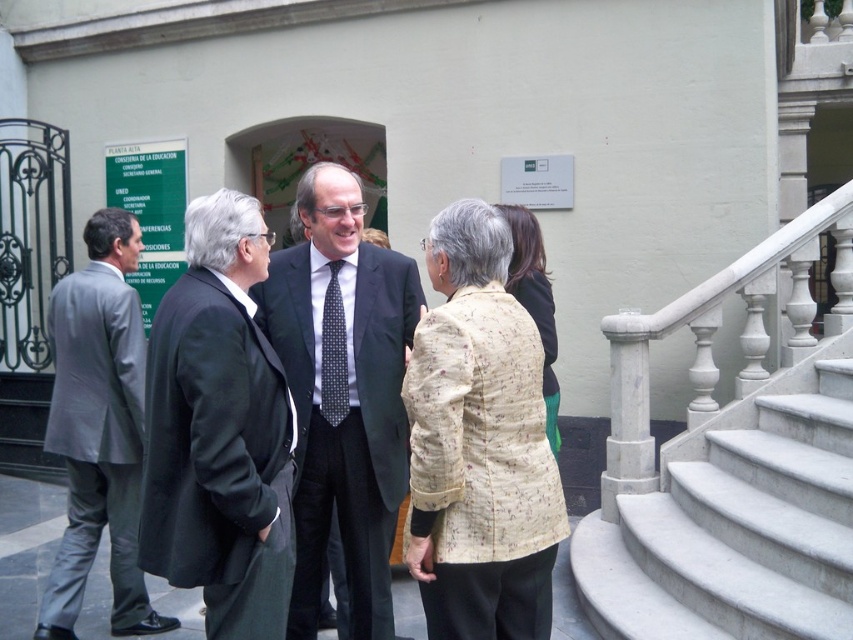
Based on the photo, you are organizing a formal event and need to ensure that all attire items are displayed properly. If you have a display stand that can accommodate items up to the width of the black dotted tie at center, will the black wool coat at center fit on the same stand?

The black wool coat at center is wider than the black dotted tie at center, so it will not fit on the display stand designed for the tie.